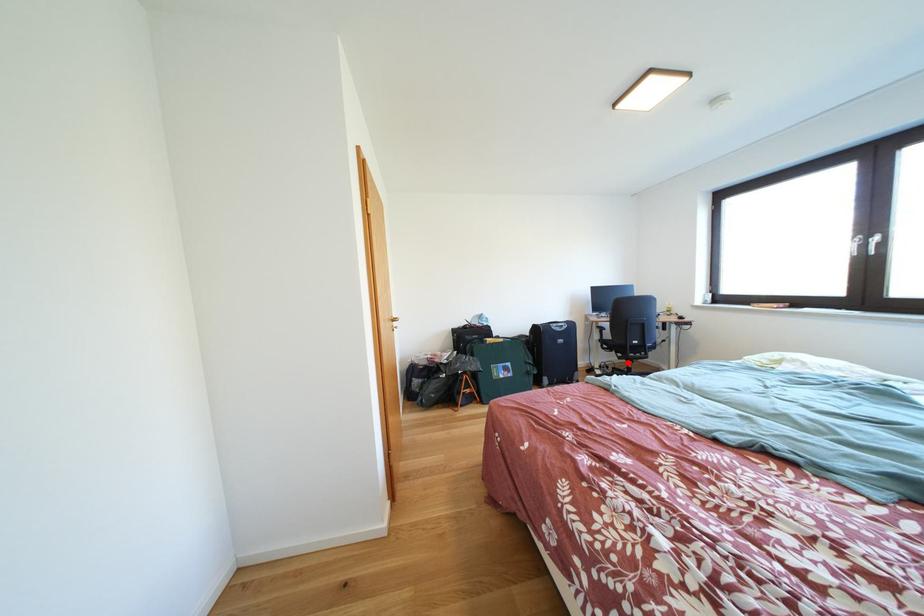
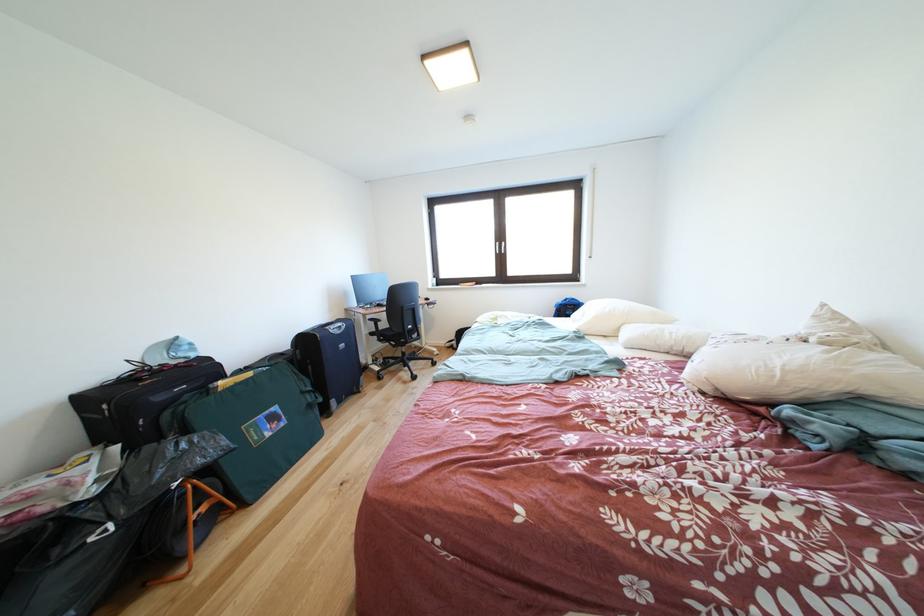
In the second image, find the point that corresponds to the highlighted location in the first image.

(403, 351)